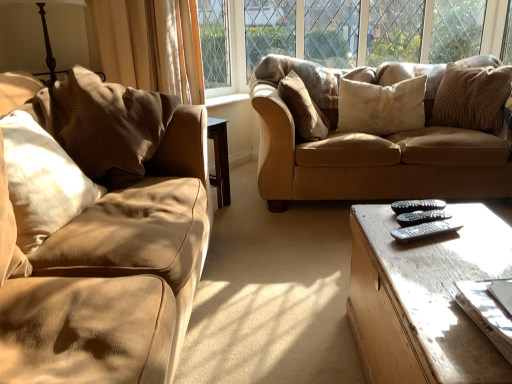
Question: Relative to black plastic remote at center, positioned as the third remote in front-to-back order, is light brown wooden coffee table at lower right in front or behind?

Choices:
 (A) behind
 (B) front

Answer: (B)

Question: From the image's perspective, is light brown wooden coffee table at lower right above or below black plastic remote at center, arranged as the first remote when viewed from the back?

Choices:
 (A) below
 (B) above

Answer: (A)

Question: Which is farther from the matte brown couch at center?

Choices:
 (A) wooden table lamp at upper left
 (B) light brown wooden coffee table at lower right
 (C) black plastic remote at center, which ranks as the 2th remote in back-to-front order
 (D) beige corduroy curtain at upper left
 (E) brown corduroy pillow at left, the fourth pillow in the right-to-left sequence

Answer: (A)

Question: Which object is the closest to the brown corduroy pillow at upper right, positioned as the fifth pillow in left-to-right order?

Choices:
 (A) black plastic remote at center, the 2th remote when ordered from front to back
 (B) matte brown couch at center
 (C) light brown wooden coffee table at lower right
 (D) white corduroy pillow at upper right, the second pillow positioned from the right
 (E) brown corduroy pillow at center, which is the third pillow from left to right

Answer: (D)